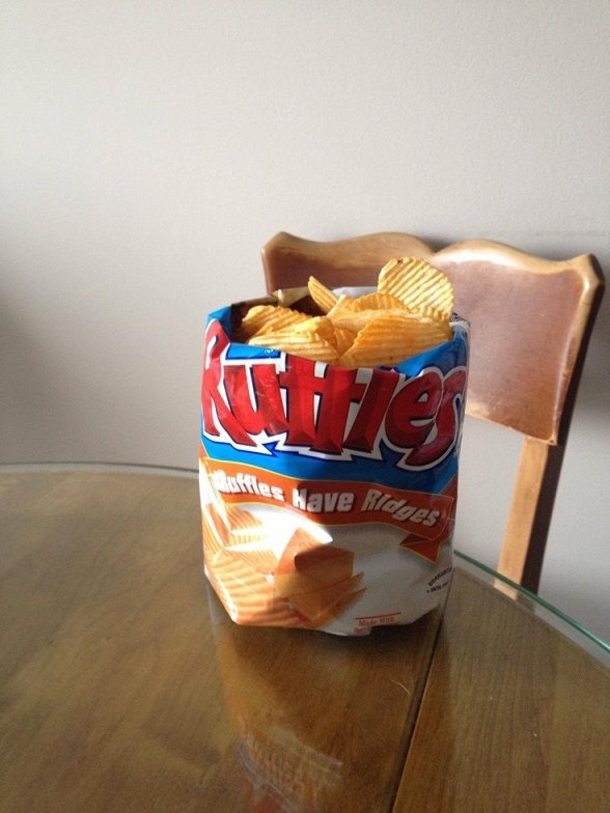
This screenshot has height=813, width=610. What are the coordinates of `chair back` in the screenshot? It's located at (526, 315).